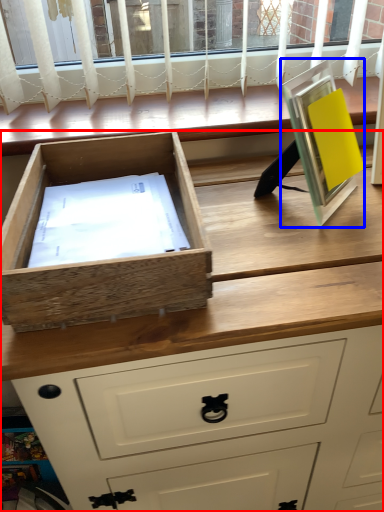
Question: Which object appears farthest to the camera in this image, chest of drawers (highlighted by a red box) or picture frame (highlighted by a blue box)?

Choices:
 (A) chest of drawers
 (B) picture frame

Answer: (B)